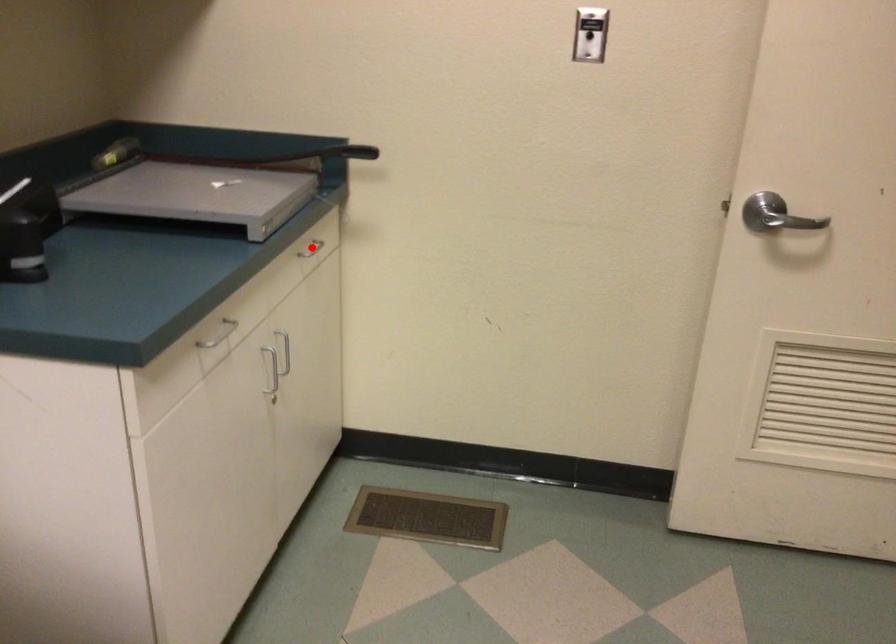
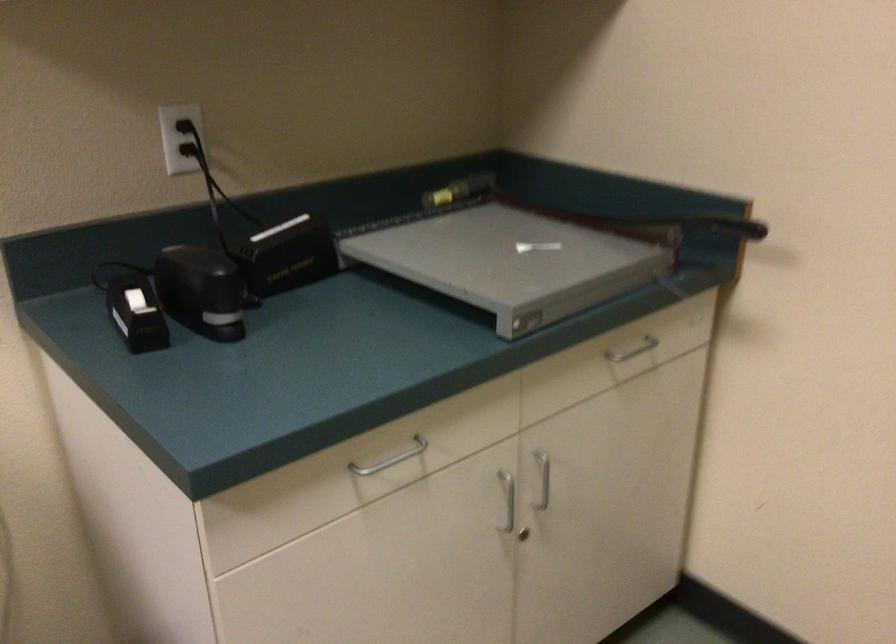
Where in the second image is the point corresponding to the highlighted location from the first image?

(633, 348)